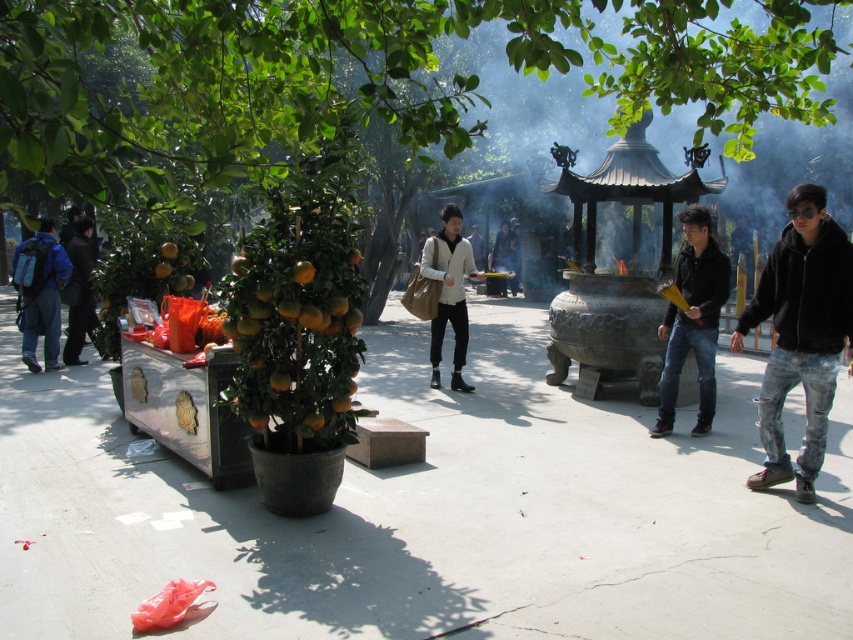
You are a visitor at the temple and want to take a photo of the green glossy tree at center and the black fuzzy jacket at right. However, you need to adjust your camera angle so that both objects are fully visible in the frame. Which object should you focus on first to ensure both are in the shot?

The green glossy tree at center is taller than the black fuzzy jacket at right, so you should focus on the taller green glossy tree at center first to ensure both are fully visible in the frame.

You are standing at the center of the temple area and want to place a new offering on the small table near the green glossy tree at center. However, you are carrying a large ceremonial tray that is 5 meters wide. Can you safely move the tray from your current position to the table without it hitting the matte beige jacket at center?

The distance between the green glossy tree at center and the matte beige jacket at center is 5.27 meters. Since the tray is 5 meters wide, there is enough space to move it safely without hitting the matte beige jacket at center.

You are a visitor at the temple and want to take a photo of both the green glossy tree at center and the matte beige jacket at center. Since you want both in the frame, which object should you focus on to ensure both are visible?

You should focus on the green glossy tree at center because it is bigger than the matte beige jacket at center, so keeping it in focus will naturally include the smaller matte beige jacket at center in the frame.